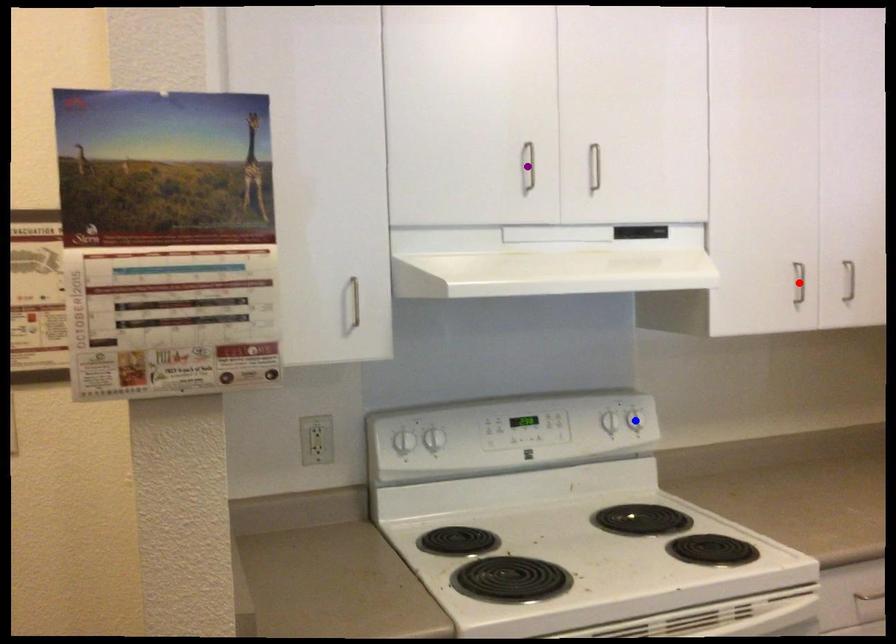
Order these from nearest to farthest:
A) red point
B) purple point
C) blue point

blue point → red point → purple point